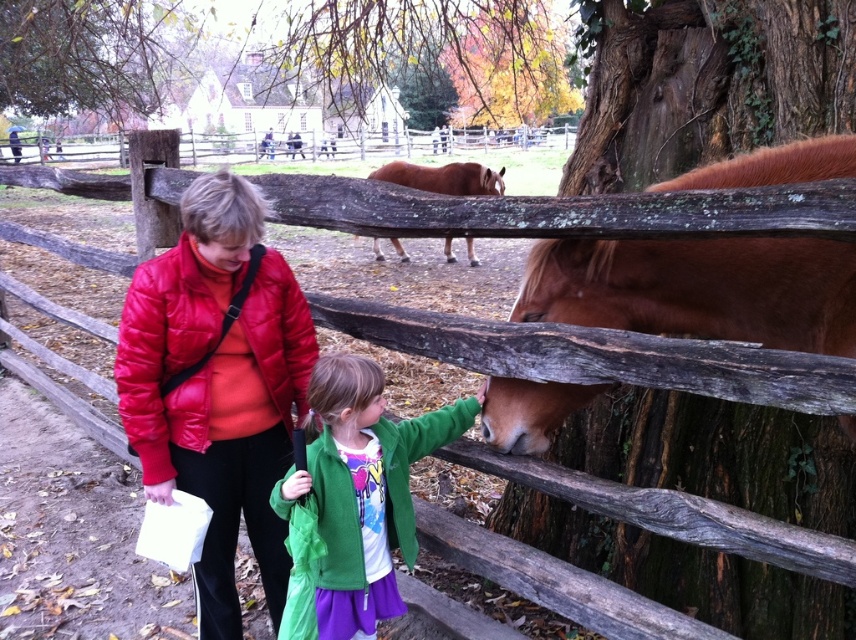
Question: From the image, what is the correct spatial relationship of brown fuzzy horse at center in relation to green fuzzy jacket at center?

Choices:
 (A) below
 (B) above

Answer: (B)

Question: Which point appears farthest from the camera in this image?

Choices:
 (A) (426, 176)
 (B) (379, 525)
 (C) (187, 266)
 (D) (741, 275)

Answer: (A)

Question: Is shiny red jacket at left positioned in front of brown glossy horse at center?

Choices:
 (A) yes
 (B) no

Answer: (A)

Question: Which point is closer to the camera?

Choices:
 (A) [x=373, y=518]
 (B) [x=755, y=241]

Answer: (B)

Question: Which point is farther to the camera?

Choices:
 (A) green fuzzy jacket at center
 (B) shiny red jacket at left

Answer: (A)

Question: Is shiny red jacket at left further to the viewer compared to brown fuzzy horse at center?

Choices:
 (A) yes
 (B) no

Answer: (A)